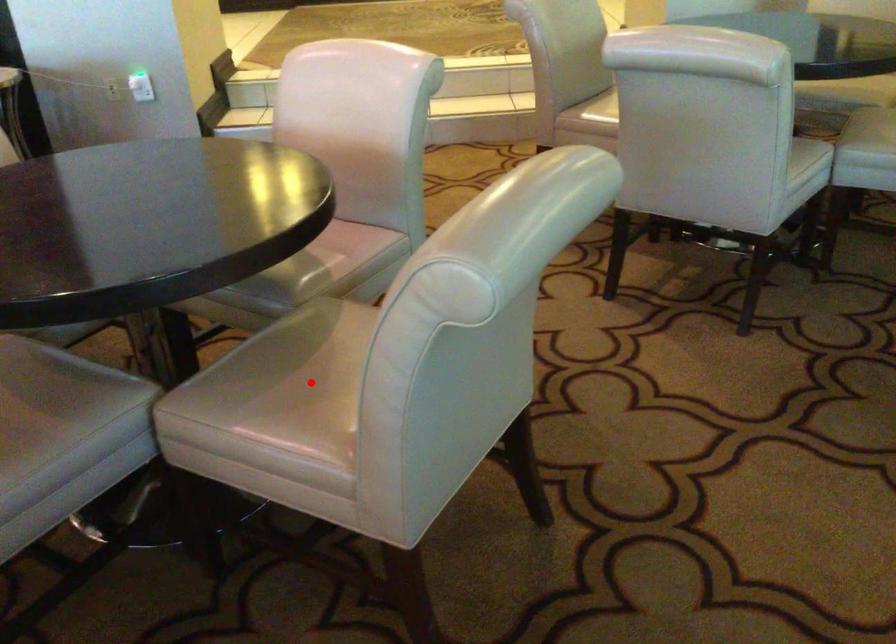
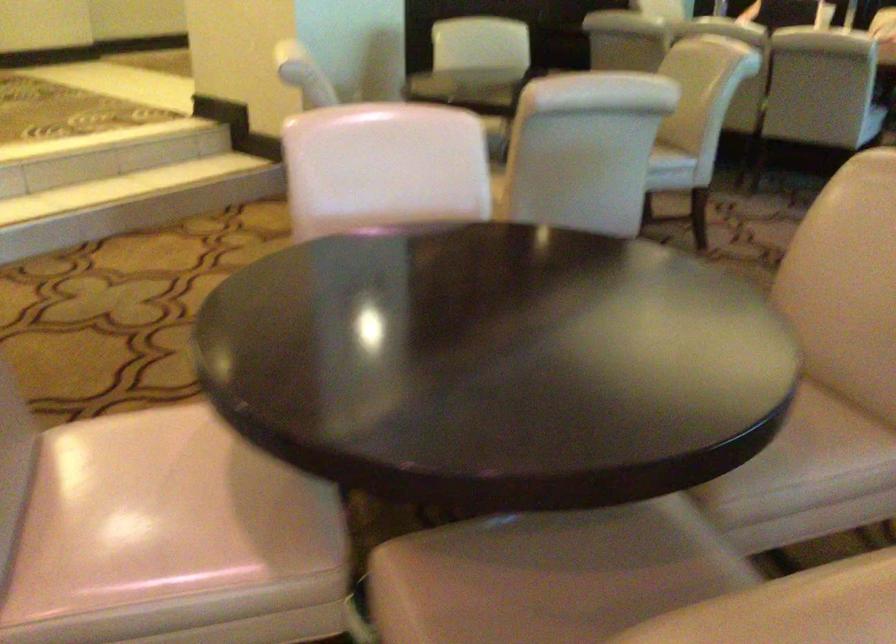
Question: I am providing you with two images of the same scene from different viewpoints. A red point is marked on the first image. Is the red point's position out of view in image 2?

Choices:
 (A) Yes
 (B) No

Answer: (A)